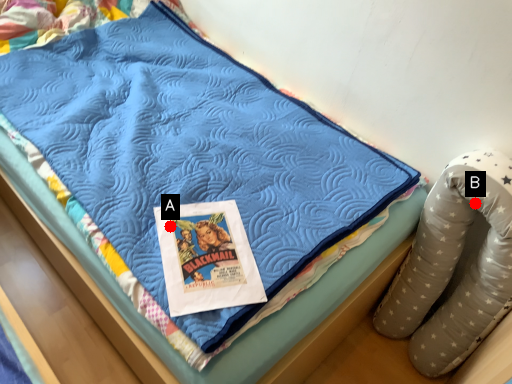
Question: Two points are circled on the image, labeled by A and B beside each circle. Which point is further to the camera?

Choices:
 (A) A is further
 (B) B is further

Answer: (B)